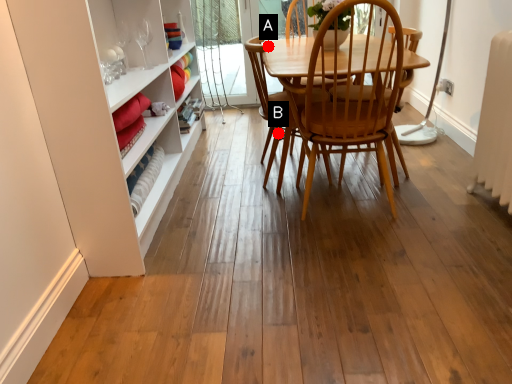
Question: Two points are circled on the image, labeled by A and B beside each circle. Which point is further to the camera?

Choices:
 (A) A is further
 (B) B is further

Answer: (B)